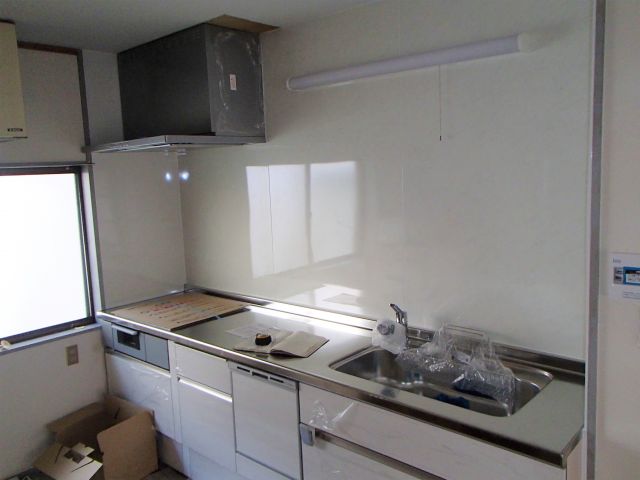
Where is `rectangular shaped sticker`? The width and height of the screenshot is (640, 480). rectangular shaped sticker is located at coordinates (628, 285).